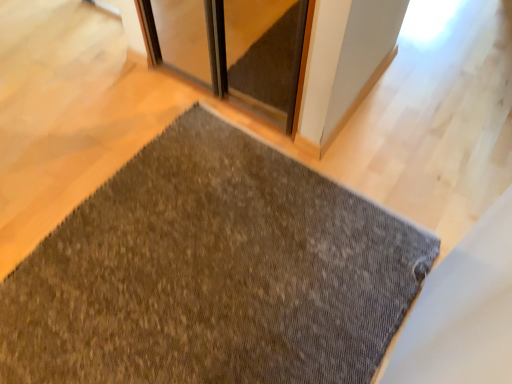
This screenshot has height=384, width=512. Describe the element at coordinates (213, 273) in the screenshot. I see `brown textured mat at center` at that location.

The width and height of the screenshot is (512, 384). Find the location of `brown textured mat at center`. brown textured mat at center is located at coordinates (213, 273).

Find the location of `brown textured mat at center`. brown textured mat at center is located at coordinates (213, 273).